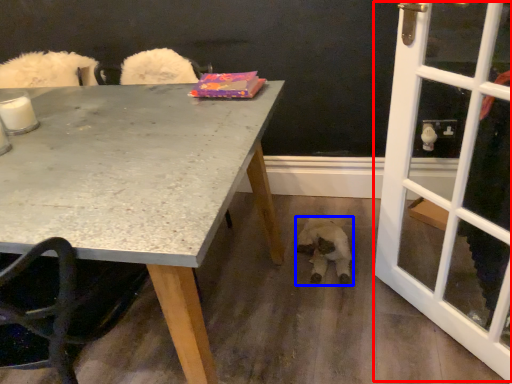
Question: Which of the following is the farthest to the observer, screen door (highlighted by a red box) or animal (highlighted by a blue box)?

Choices:
 (A) screen door
 (B) animal

Answer: (B)